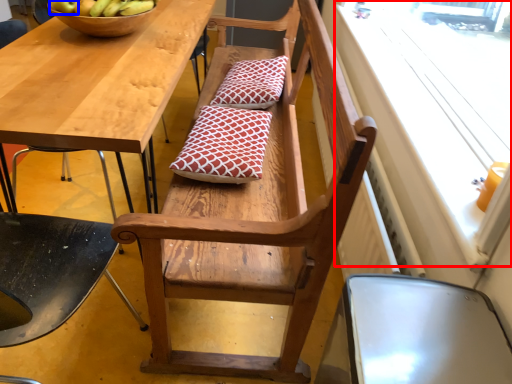
Question: Which of the following is the farthest to the observer, window screen (highlighted by a red box) or apple (highlighted by a blue box)?

Choices:
 (A) window screen
 (B) apple

Answer: (B)